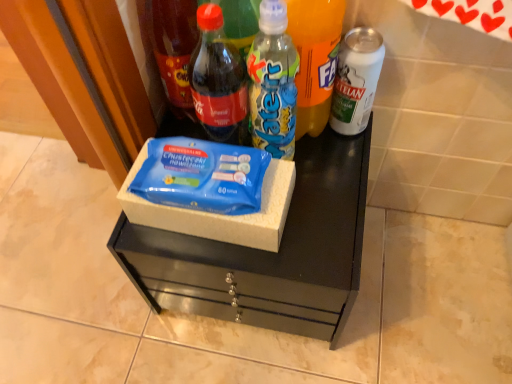
Question: Considering the positions of point (218, 72) and point (362, 122), is point (218, 72) closer or farther from the camera than point (362, 122)?

Choices:
 (A) farther
 (B) closer

Answer: (B)

Question: Considering the positions of matte glass bottle at center, positioned as the second bottle in left-to-right order, and white matte can at right, the fifth bottle viewed from the left, in the image, is matte glass bottle at center, positioned as the second bottle in left-to-right order, wider or thinner than white matte can at right, the fifth bottle viewed from the left,?

Choices:
 (A) thin
 (B) wide

Answer: (A)

Question: Which object is the closest to the white matte can at right, the fifth bottle viewed from the left?

Choices:
 (A) blue cardboard box at center
 (B) matte glass bottle at center, positioned as the second bottle in left-to-right order
 (C) translucent plastic bottle at center, the fourth bottle positioned from the left
 (D) matte glass bottle at upper left, which ranks as the first bottle in left-to-right order
 (E) translucent plastic water bottle at center, the 3th bottle from the left

Answer: (C)

Question: Estimate the real-world distances between objects in this image. Which object is farther from the translucent plastic bottle at center, placed as the second bottle when sorted from right to left?

Choices:
 (A) matte glass bottle at center, positioned as the second bottle in left-to-right order
 (B) white matte can at right, marked as the 1th bottle in a right-to-left arrangement
 (C) blue matte wipes at center
 (D) matte glass bottle at upper left, arranged as the 5th bottle when viewed from the right
 (E) translucent plastic water bottle at center, which is counted as the third bottle, starting from the right

Answer: (C)